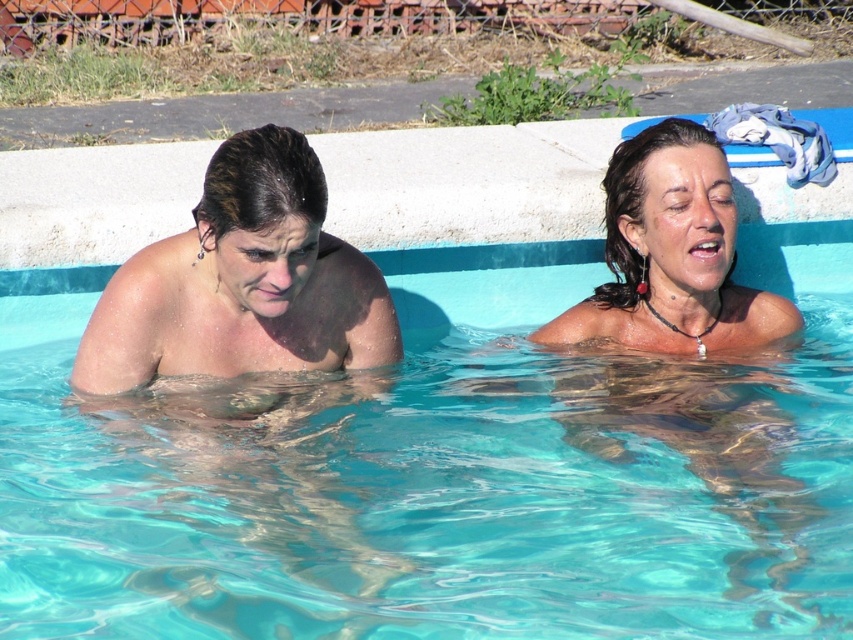
You are standing at the edge of the pool and want to jump into the clear blue water at center. Based on its 2D coordinates, where should you aim to land?

You should aim for the coordinates point at (419, 477) to land in the clear blue water at center.